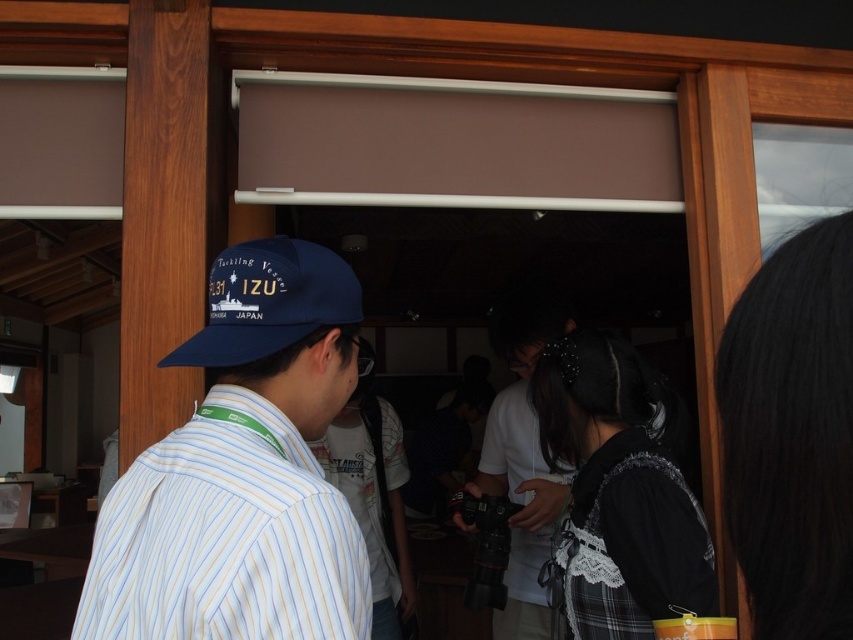
Is matte blue baseball cap at upper left above striped cotton shirt at center?

Yes, matte blue baseball cap at upper left is above striped cotton shirt at center.

What do you see at coordinates (270, 301) in the screenshot?
I see `matte blue baseball cap at upper left` at bounding box center [270, 301].

The height and width of the screenshot is (640, 853). I want to click on matte blue baseball cap at upper left, so click(x=270, y=301).

Which is in front, point (541, 460) or point (264, 369)?

Point (264, 369) is in front.

The image size is (853, 640). What do you see at coordinates (521, 461) in the screenshot?
I see `white matte shirt at center` at bounding box center [521, 461].

Is point (514, 387) behind point (273, 266)?

Yes, point (514, 387) is farther from viewer.

This screenshot has height=640, width=853. Identify the location of white matte shirt at center. (521, 461).

Is blue fabric cap at center taller than white matte shirt at center?

No, blue fabric cap at center is not taller than white matte shirt at center.

Is blue fabric cap at center above white matte shirt at center?

Correct, blue fabric cap at center is located above white matte shirt at center.

The image size is (853, 640). What are the coordinates of `blue fabric cap at center` in the screenshot? It's located at (242, 472).